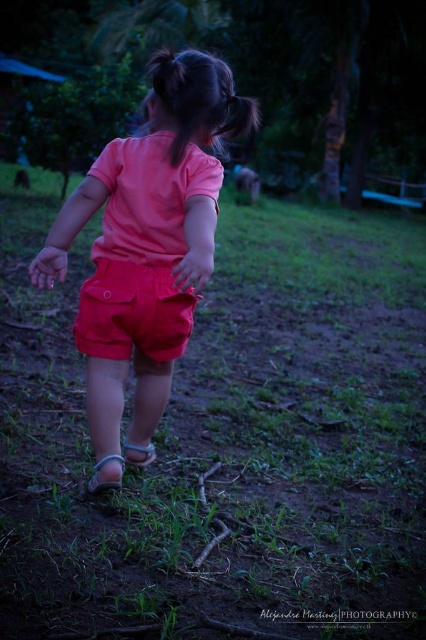
You are standing at the point labeled point (x=135, y=300) and want to walk towards the point labeled point (x=244, y=116). Which direction should you face to move towards it?

Since point (x=135, y=300) is closer to the viewer than point (x=244, y=116), you should face away from the viewer to move towards point (x=244, y=116).

Based on the scene description, which object is shorter between the matte cotton shorts at center and the black silky hair at upper center?

The matte cotton shorts at center has a lesser height compared to the black silky hair at upper center, so the matte cotton shorts at center is shorter.